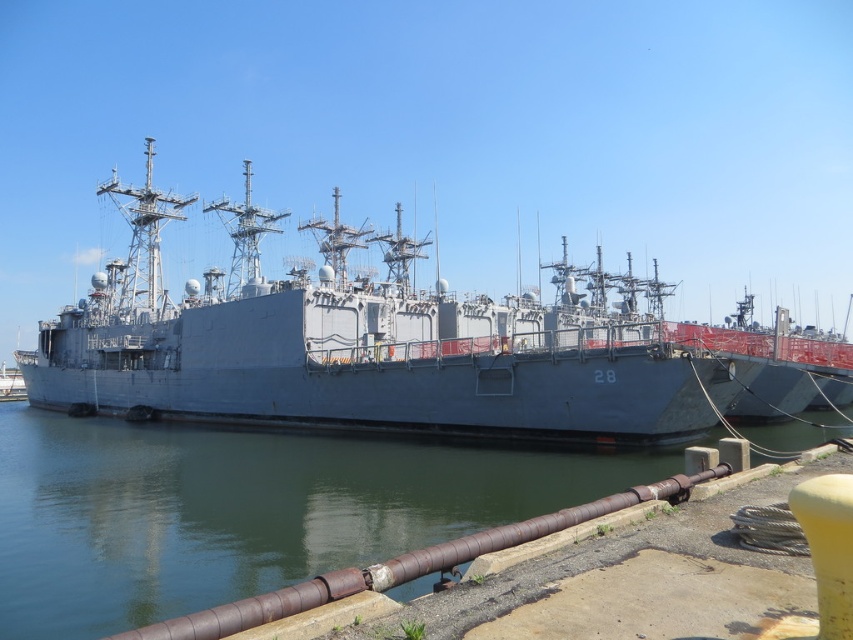
You are a marine engineer assessing the safety of the ship. The ship must maintain a minimum distance of 100 feet from the water to prevent corrosion. Based on the provided information, does the gray metallic ship at center meet this requirement relative to the greenish water at lower left?

The distance between the gray metallic ship at center and the greenish water at lower left is 97.60 feet, which is less than the required 100 feet. Therefore, the ship does not meet the safety requirement and may be at risk of corrosion.

You are a sailor on the pier and want to board the gray metallic ship at center. From your current position on the pier, which direction should you walk to face the greenish water at lower left?

You should walk towards the gray metallic ship at center, as it is positioned over the greenish water at lower left. Facing the ship would mean you are also facing the water beneath it.